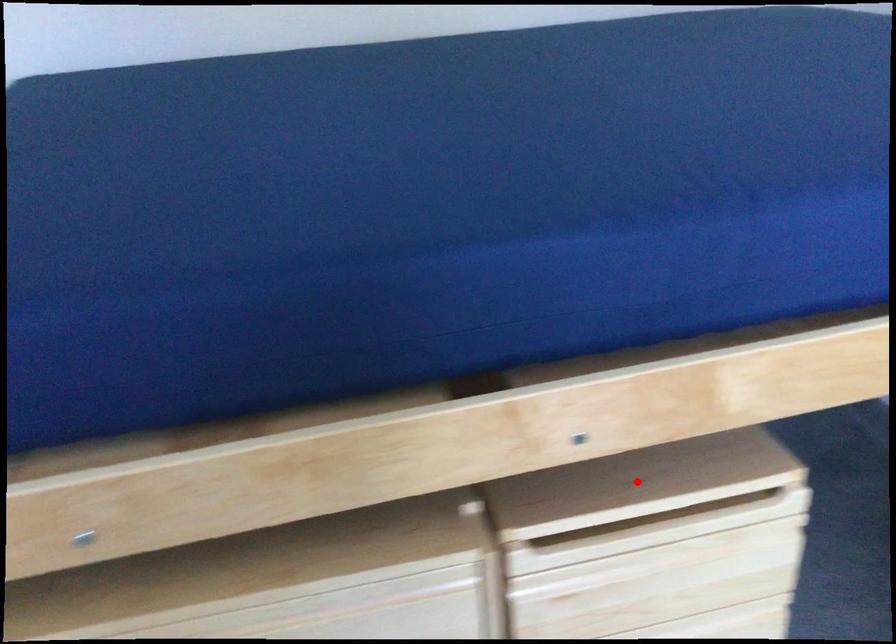
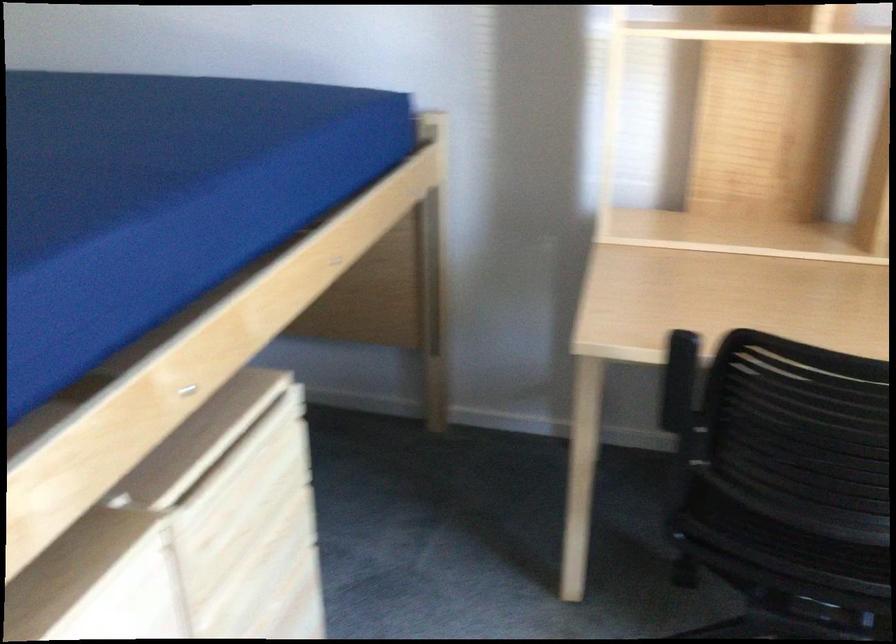
Question: I am providing you with two images of the same scene from different viewpoints. In image1, a red point is highlighted. Considering the same 3D point in image2, which of the following is correct?

Choices:
 (A) It is closer
 (B) It is farther

Answer: (B)